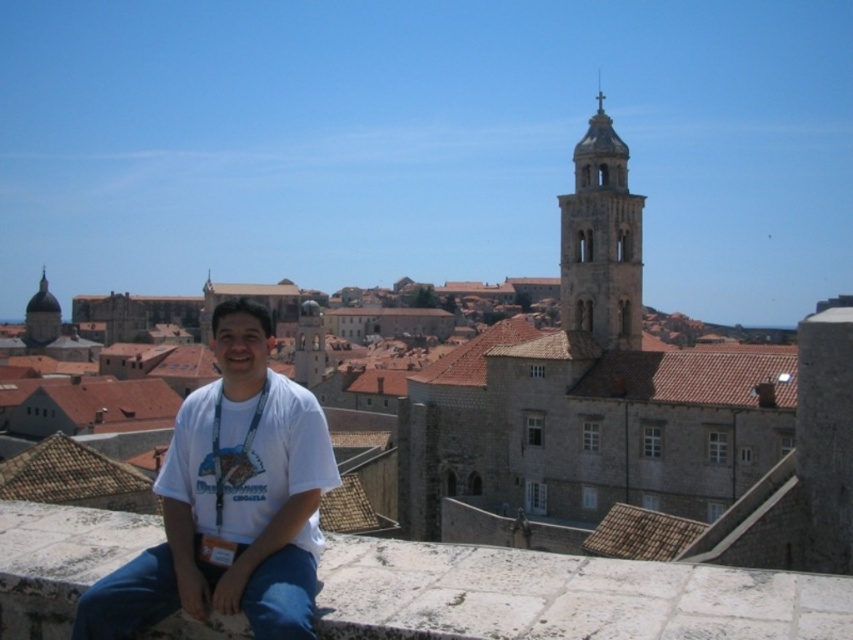
Question: Does white cotton shirt at center have a larger size compared to smooth stone tower at upper right?

Choices:
 (A) no
 (B) yes

Answer: (A)

Question: Can you confirm if white cotton shirt at center is bigger than matte brown dome at upper left?

Choices:
 (A) no
 (B) yes

Answer: (B)

Question: Among these objects, which one is farthest from the camera?

Choices:
 (A) matte brown dome at upper left
 (B) white cotton shirt at center
 (C) smooth stone tower at upper right

Answer: (A)

Question: Which of the following is the closest to the observer?

Choices:
 (A) smooth stone tower at upper right
 (B) matte brown dome at upper left
 (C) white cotton shirt at center

Answer: (C)

Question: Does white cotton shirt at center come in front of matte brown dome at upper left?

Choices:
 (A) yes
 (B) no

Answer: (A)

Question: Which point is closer to the camera taking this photo?

Choices:
 (A) (38, 301)
 (B) (294, 481)

Answer: (B)